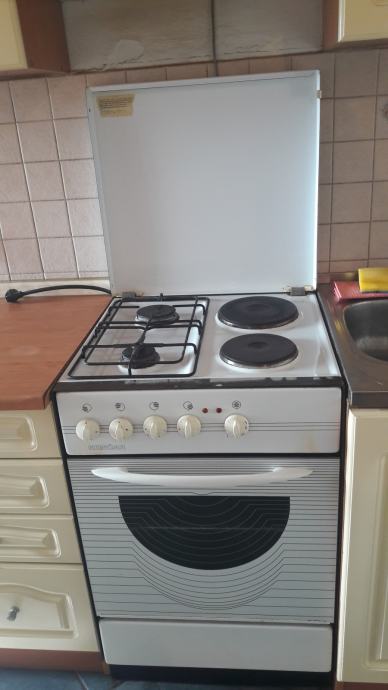
Locate an element on the screen. The width and height of the screenshot is (388, 690). black plug is located at coordinates coord(14,295).